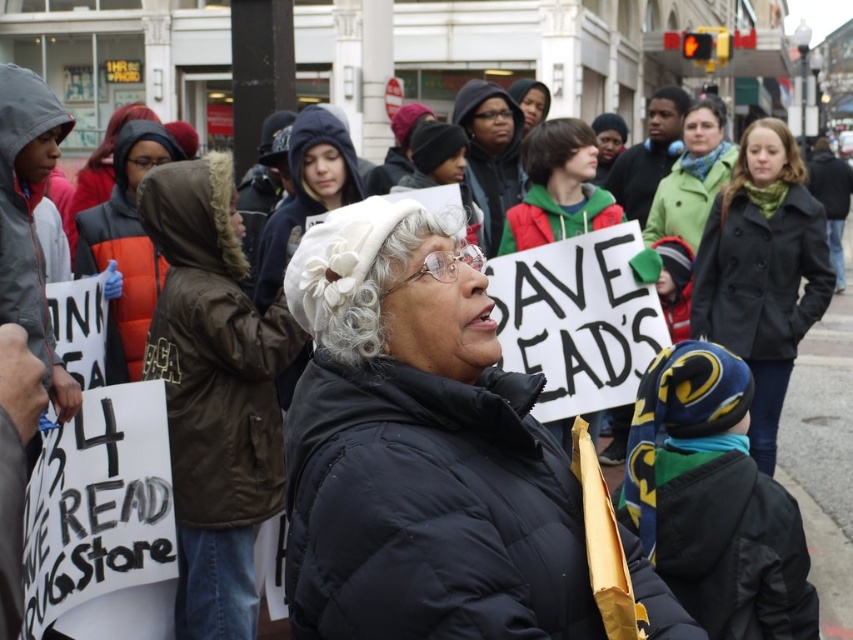
You are a photographer trying to capture a clear shot of both the white fabric hat at center and the brown fuzzy wig at upper center. Since you want to ensure both are visible in the frame, which object should you focus on first to account for their height difference?

The white fabric hat at center is taller than the brown fuzzy wig at upper center, so you should focus on the white fabric hat at center first to ensure its height is properly framed before adjusting for the shorter brown fuzzy wig at upper center.

You are organizing a costume party and need to decide which of the two items, the white fabric hat at center or the brown fuzzy wig at upper center, can accommodate a larger head. Based on the image, which one would you choose?

The white fabric hat at center has a larger size compared to the brown fuzzy wig at upper center, so you should choose the white fabric hat at center for accommodating a larger head.

You are a photographer standing at the edge of the protest, and you want to take a closeup shot of the dark gray wool coat at center. Your camera has a maximum zoom range of 10 meters. Can you capture the coat clearly without moving closer?

The dark gray wool coat at center is 11.31 meters away from viewer. Since the camera can only zoom up to 10 meters, you cannot capture the coat clearly without moving closer.